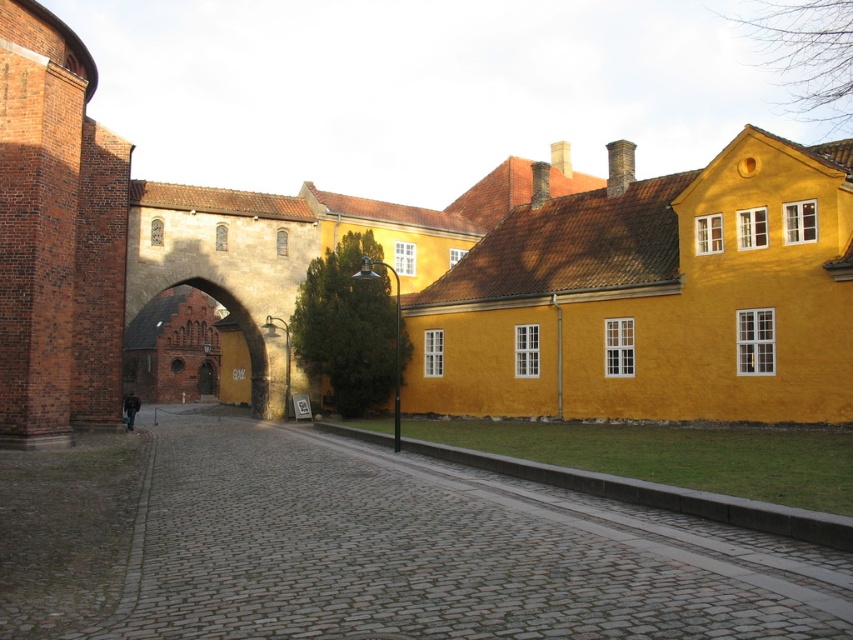
Who is more distant from viewer, (387, 534) or (177, 304)?

The point (177, 304) is more distant.

Which of these two, cobblestone alley at center or brown stone archway at center, stands shorter?

cobblestone alley at center

Is point (22, 614) closer to viewer compared to point (254, 365)?

Yes, it is.

Locate an element on the screen. cobblestone alley at center is located at coordinates (369, 547).